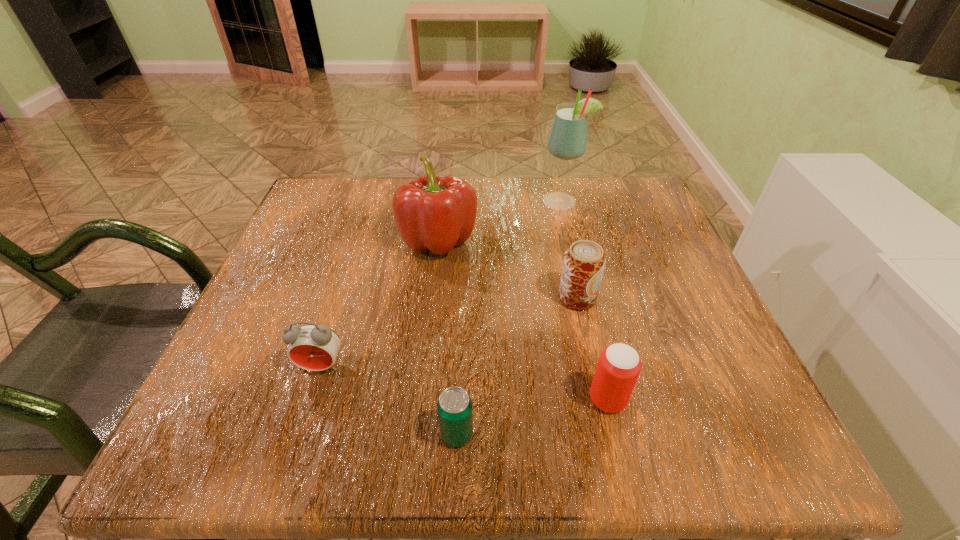
The height and width of the screenshot is (540, 960). Find the location of `the tallest object`. the tallest object is located at coordinates (568, 139).

Image resolution: width=960 pixels, height=540 pixels. I want to click on the farthest object, so click(x=568, y=139).

Locate an element on the screen. This screenshot has height=540, width=960. the fifth nearest object is located at coordinates (433, 213).

This screenshot has width=960, height=540. I want to click on pepper, so click(x=433, y=213).

Identify the location of the fourth nearest object. (584, 262).

You are a GUI agent. You are given a task and a screenshot of the screen. Output one action in this format:
    pyautogui.click(x=<x>, y=<y>)
    Task: Click on the third nearest object
    This screenshot has height=540, width=960.
    Given the screenshot: What is the action you would take?
    pyautogui.click(x=313, y=347)

Locate an element on the screen. The width and height of the screenshot is (960, 540). alarm clock is located at coordinates (313, 347).

Find the location of a particular element. The width and height of the screenshot is (960, 540). the second nearest beer can is located at coordinates (619, 365).

You are a GUI agent. You are given a task and a screenshot of the screen. Output one action in this format:
    pyautogui.click(x=<x>, y=<y>)
    Task: Click on the leftmost beer can
    The height and width of the screenshot is (540, 960).
    Given the screenshot: What is the action you would take?
    point(454,406)

Where is `the shortest beer can`? the shortest beer can is located at coordinates (454, 406).